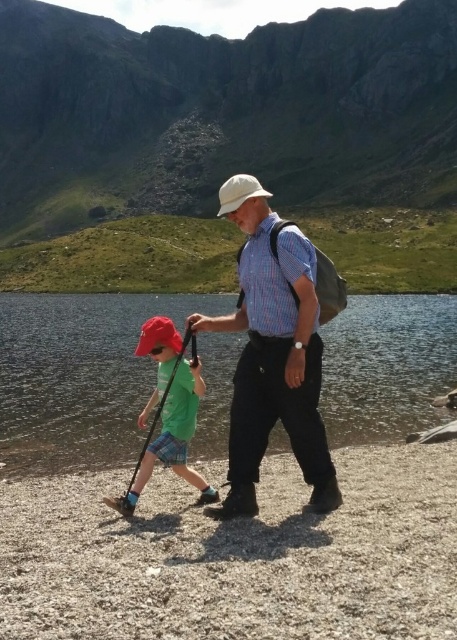
You are a hiker planning to cross the clear water at lower center. You see the green matte shirt at center of the hiker ahead. Which direction should you move to reach the water first without going around?

The clear water at lower center is to the right of the green matte shirt at center, so you should move to the right to reach the water first without going around.

Based on the scene described, where exactly is the clear water at lower center located in terms of coordinates?

The clear water at lower center is located at coordinates point (78, 376).